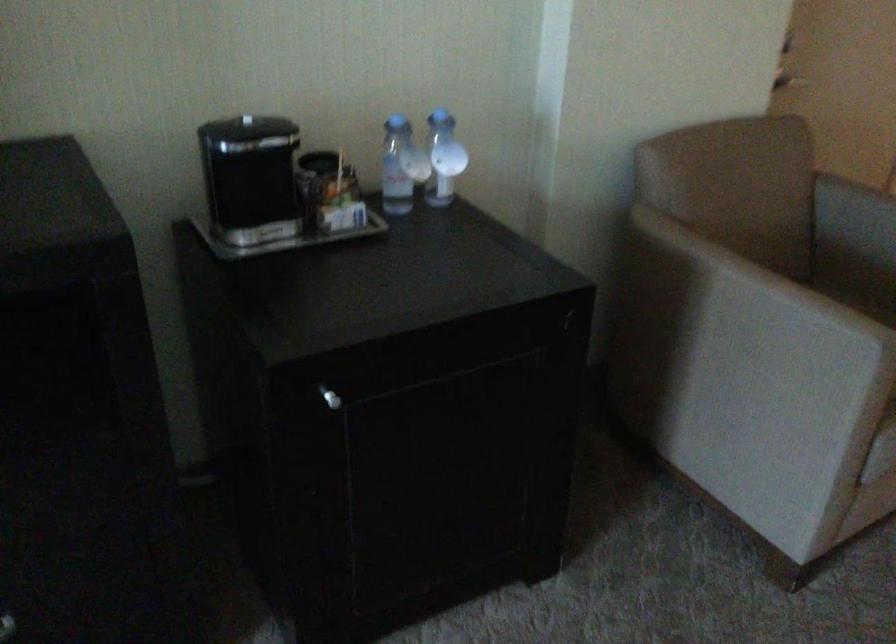
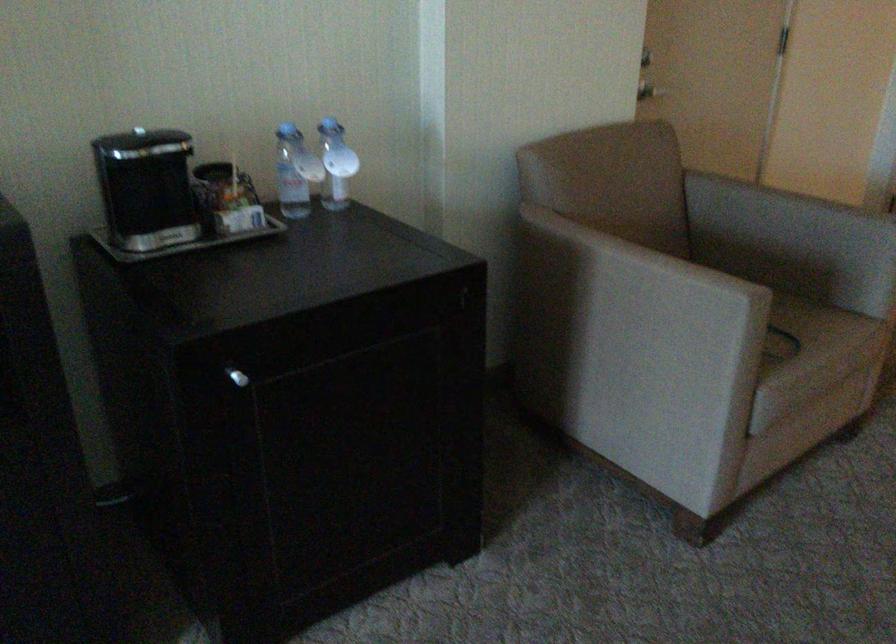
Locate, in the second image, the point that corresponds to (330,399) in the first image.

(237, 377)